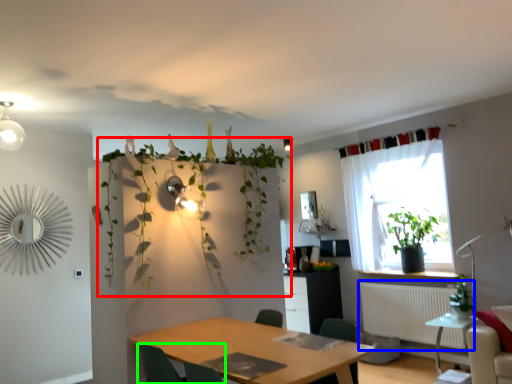
Question: Considering the real-world distances, which object is farthest from vegetation (highlighted by a red box)? radiator (highlighted by a blue box) or chair (highlighted by a green box)?

Choices:
 (A) radiator
 (B) chair

Answer: (A)